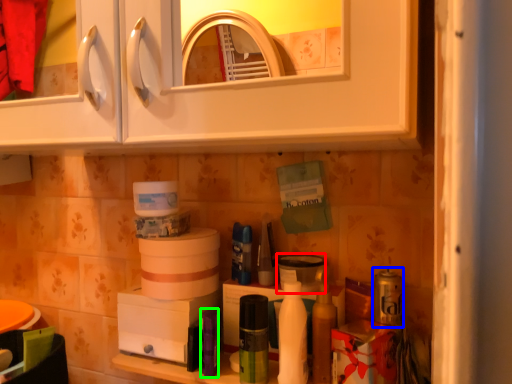
Question: Which is nearer to the appliance (highlighted by a red box)? toiletry (highlighted by a blue box) or toiletry (highlighted by a green box).

Choices:
 (A) toiletry
 (B) toiletry

Answer: (A)